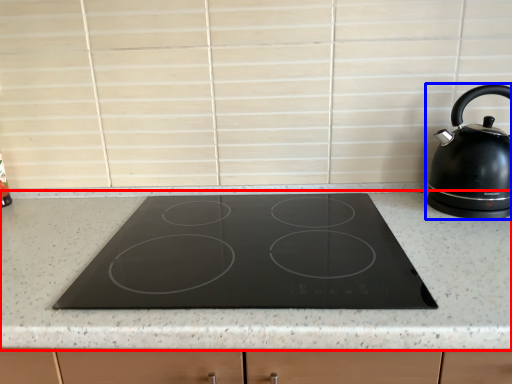
Question: Which object is closer to the camera taking this photo, countertop (highlighted by a red box) or kettle (highlighted by a blue box)?

Choices:
 (A) countertop
 (B) kettle

Answer: (A)